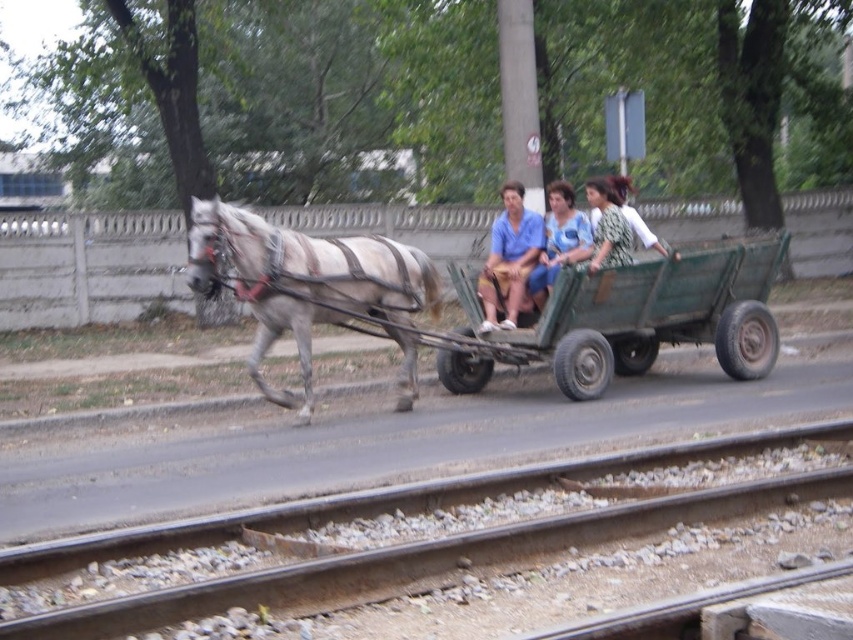
Describe the element at coordinates (509, 257) in the screenshot. The image size is (853, 640). I see `matte blue shirt at center` at that location.

Who is positioned more to the right, matte blue shirt at center or blue cotton shirt at center?

blue cotton shirt at center is more to the right.

Locate an element on the screen. matte blue shirt at center is located at coordinates (509, 257).

In order to click on matte blue shirt at center in this screenshot , I will do `click(509, 257)`.

Who is more forward, (360, 252) or (627, 177)?

Point (360, 252) is more forward.

Can you confirm if gray matte horse at left is positioned to the left of green textured dress at center?

Correct, you'll find gray matte horse at left to the left of green textured dress at center.

Where is `gray matte horse at left`? This screenshot has width=853, height=640. gray matte horse at left is located at coordinates (310, 285).

Can you confirm if green wooden wagon at center is wider than matte blue shirt at center?

Indeed, green wooden wagon at center has a greater width compared to matte blue shirt at center.

Which is above, green wooden wagon at center or matte blue shirt at center?

matte blue shirt at center is above.

The width and height of the screenshot is (853, 640). Describe the element at coordinates (631, 320) in the screenshot. I see `green wooden wagon at center` at that location.

The width and height of the screenshot is (853, 640). Identify the location of green wooden wagon at center. (631, 320).